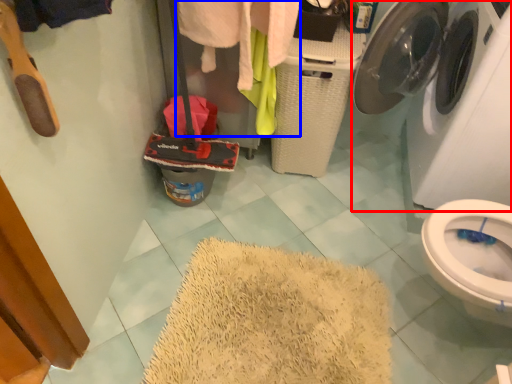
Question: Which object appears farthest to the camera in this image, washing machine (highlighted by a red box) or clothing (highlighted by a blue box)?

Choices:
 (A) washing machine
 (B) clothing

Answer: (B)